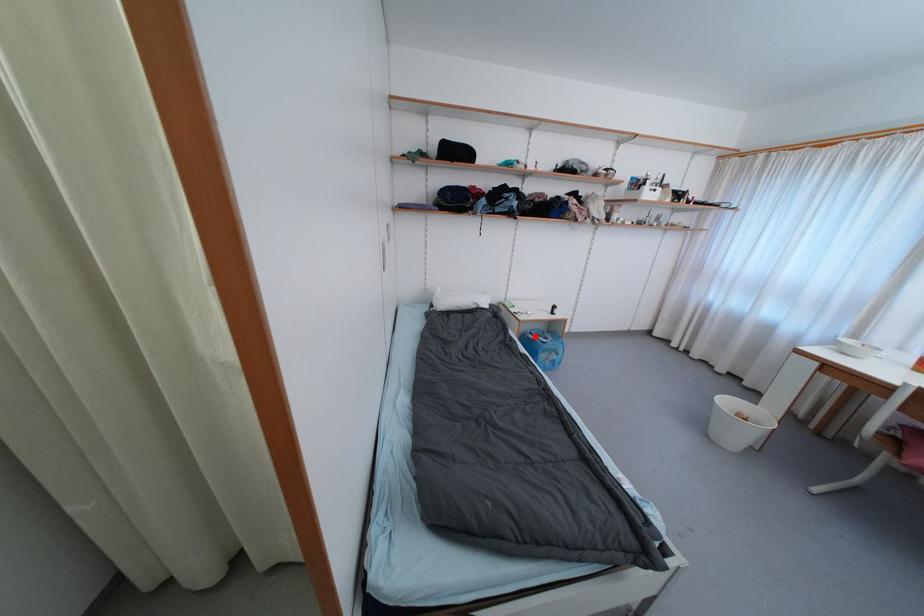
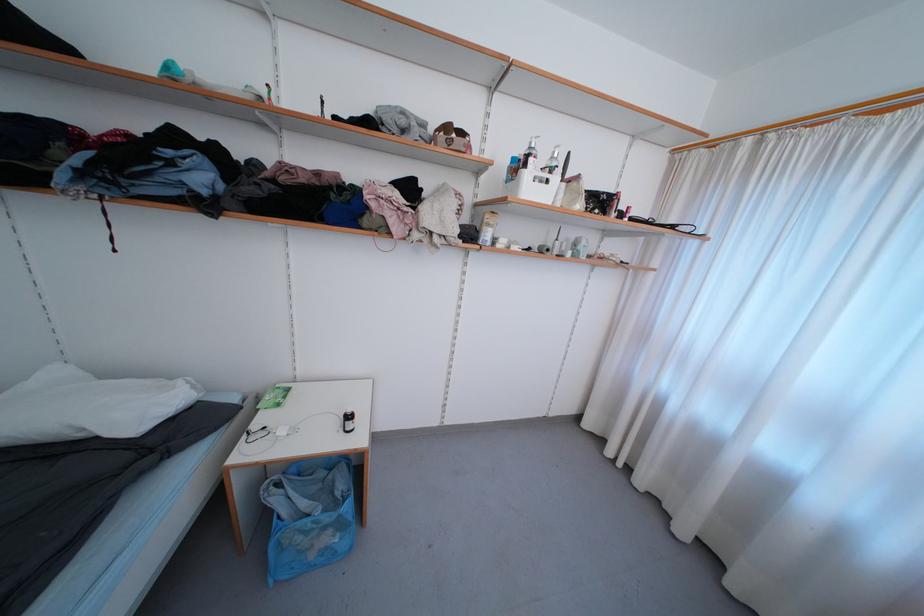
Question: A red point is marked in image1. In image2, is the corresponding 3D point closer to the camera or farther? Reply with the corresponding letter.

Choices:
 (A) The corresponding 3D point is closer.
 (B) The corresponding 3D point is farther.

Answer: (A)